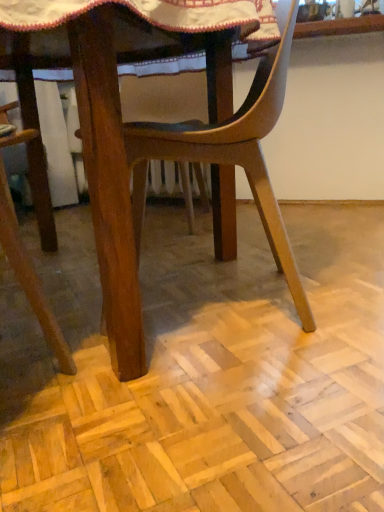
Question: Considering the relative sizes of wooden chair at center and light brown wood parquet floor at center in the image provided, is wooden chair at center taller than light brown wood parquet floor at center?

Choices:
 (A) no
 (B) yes

Answer: (B)

Question: Is wooden chair at center shorter than light brown wood parquet floor at center?

Choices:
 (A) yes
 (B) no

Answer: (B)

Question: From a real-world perspective, is wooden chair at center below light brown wood parquet floor at center?

Choices:
 (A) no
 (B) yes

Answer: (A)

Question: Is wooden chair at center not close to light brown wood parquet floor at center?

Choices:
 (A) yes
 (B) no

Answer: (B)

Question: Can you confirm if wooden chair at center is positioned to the left of light brown wood parquet floor at center?

Choices:
 (A) no
 (B) yes

Answer: (B)

Question: Could you tell me if wooden chair at center is turned towards light brown wood parquet floor at center?

Choices:
 (A) no
 (B) yes

Answer: (A)

Question: Considering the relative sizes of light brown wood parquet floor at center and wooden chair at center in the image provided, is light brown wood parquet floor at center taller than wooden chair at center?

Choices:
 (A) no
 (B) yes

Answer: (A)

Question: Is light brown wood parquet floor at center not within wooden chair at center?

Choices:
 (A) no
 (B) yes

Answer: (B)

Question: Is light brown wood parquet floor at center to the right of wooden chair at center from the viewer's perspective?

Choices:
 (A) no
 (B) yes

Answer: (B)

Question: Does light brown wood parquet floor at center have a larger size compared to wooden chair at center?

Choices:
 (A) yes
 (B) no

Answer: (B)

Question: Does light brown wood parquet floor at center have a smaller size compared to wooden chair at center?

Choices:
 (A) no
 (B) yes

Answer: (B)

Question: Is light brown wood parquet floor at center turned away from wooden chair at center?

Choices:
 (A) yes
 (B) no

Answer: (B)

Question: Choose the correct answer: Is wooden chair at center inside light brown wood parquet floor at center or outside it?

Choices:
 (A) outside
 (B) inside

Answer: (A)